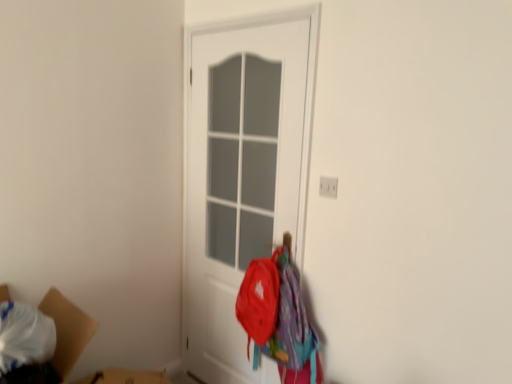
Question: From a real-world perspective, is white matte door at center beneath matte red backpack at lower right?

Choices:
 (A) yes
 (B) no

Answer: (B)

Question: Is white matte door at center to the left of matte red backpack at lower right from the viewer's perspective?

Choices:
 (A) no
 (B) yes

Answer: (B)

Question: Would you say white matte door at center is a long distance from matte red backpack at lower right?

Choices:
 (A) no
 (B) yes

Answer: (A)

Question: From the image's perspective, is white matte door at center on matte red backpack at lower right?

Choices:
 (A) no
 (B) yes

Answer: (B)

Question: Does white matte door at center have a greater width compared to matte red backpack at lower right?

Choices:
 (A) no
 (B) yes

Answer: (A)

Question: Is point (70, 362) positioned closer to the camera than point (296, 160)?

Choices:
 (A) closer
 (B) farther

Answer: (A)

Question: Considering the positions of cardboard box at lower left and white matte door at center in the image, is cardboard box at lower left wider or thinner than white matte door at center?

Choices:
 (A) wide
 (B) thin

Answer: (A)

Question: Relative to white matte door at center, is cardboard box at lower left in front or behind?

Choices:
 (A) behind
 (B) front

Answer: (B)

Question: In terms of height, does cardboard box at lower left look taller or shorter compared to white matte door at center?

Choices:
 (A) tall
 (B) short

Answer: (B)

Question: Looking at the image, does cardboard box at lower left seem bigger or smaller compared to white plastic electric outlet at upper right?

Choices:
 (A) big
 (B) small

Answer: (A)

Question: Is point (54, 360) positioned closer to the camera than point (327, 178)?

Choices:
 (A) closer
 (B) farther

Answer: (A)

Question: Considering the positions of cardboard box at lower left and white plastic electric outlet at upper right in the image, is cardboard box at lower left wider or thinner than white plastic electric outlet at upper right?

Choices:
 (A) wide
 (B) thin

Answer: (A)

Question: Relative to white plastic electric outlet at upper right, is cardboard box at lower left in front or behind?

Choices:
 (A) front
 (B) behind

Answer: (A)

Question: Does point (321, 187) appear closer or farther from the camera than point (96, 329)?

Choices:
 (A) farther
 (B) closer

Answer: (B)

Question: From a real-world perspective, is white plastic electric outlet at upper right physically located above or below cardboard box at lower left?

Choices:
 (A) above
 (B) below

Answer: (A)